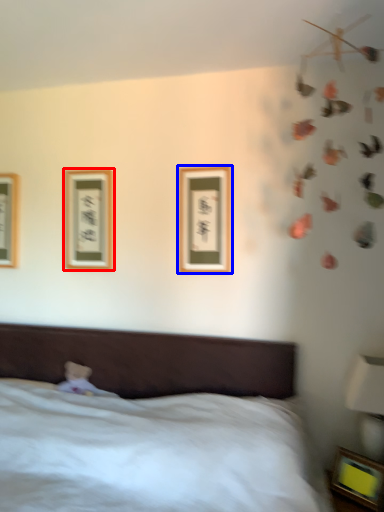
Question: Which of the following is the closest to the observer, picture frame (highlighted by a red box) or picture frame (highlighted by a blue box)?

Choices:
 (A) picture frame
 (B) picture frame

Answer: (B)